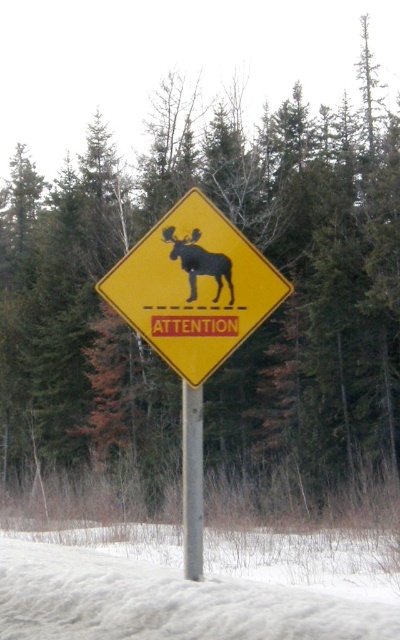
Question: Which point appears closest to the camera in this image?

Choices:
 (A) (185, 262)
 (B) (190, 406)

Answer: (B)

Question: Is metallic gray pole at center smaller than black matte moose at center?

Choices:
 (A) no
 (B) yes

Answer: (A)

Question: Is yellow plastic diamond at center closer to the viewer compared to black matte moose at center?

Choices:
 (A) yes
 (B) no

Answer: (A)

Question: Which point appears closest to the camera in this image?

Choices:
 (A) (202, 266)
 (B) (202, 451)

Answer: (B)

Question: Which object appears farthest from the camera in this image?

Choices:
 (A) metallic gray pole at center
 (B) black matte moose at center
 (C) white fluffy snow at lower center

Answer: (B)

Question: Does yellow plastic diamond at center appear over black matte moose at center?

Choices:
 (A) yes
 (B) no

Answer: (B)